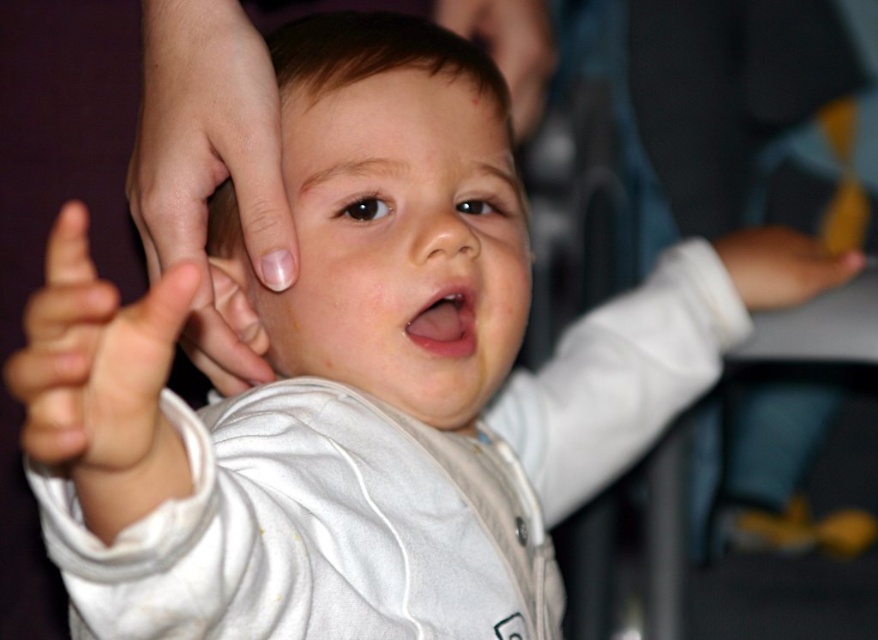
You are a photographer trying to capture a closeup of the baby. You notice two hands in the frame. The smooth skin hand at center and the white soft hand at left. Which hand should you focus on to ensure it appears clearer in the photo?

The smooth skin hand at center should be focused on because it has a larger size compared to the white soft hand at left, making it more prominent in the image.

Consider the image. You are a photographer adjusting the lighting for a baby photo shoot. You notice the white soft hand at left and the smooth skin hand at upper right in the frame. Which hand appears taller in the image?

The white soft hand at left appears taller than the smooth skin hand at upper right in the image.

You are a photographer adjusting the lighting for a baby photo shoot. You notice the smooth skin hand at center and the white soft hand at left in the frame. Which hand should you adjust the lighting to highlight more, considering their positions?

The smooth skin hand at center is taller than the white soft hand at left, so you should adjust the lighting to highlight the smooth skin hand at center more since it is positioned higher in the frame.